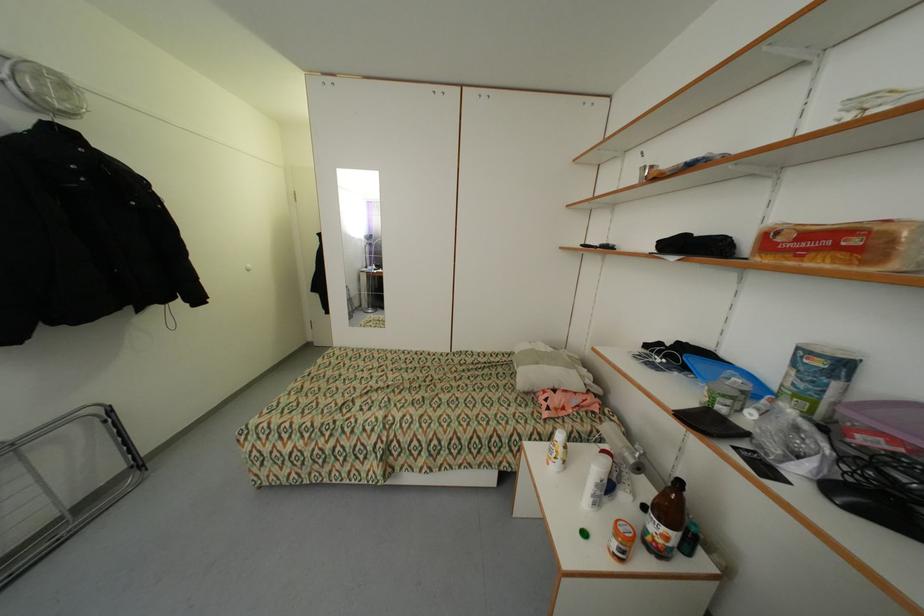
Where would you lift the container with purple lid? Please return your answer as a coordinate pair (x, y).

(883, 423)